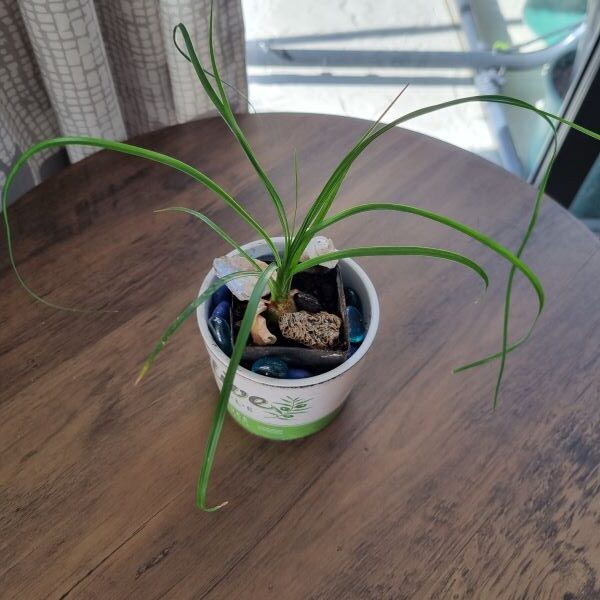
I want to click on plant, so click(283, 273).